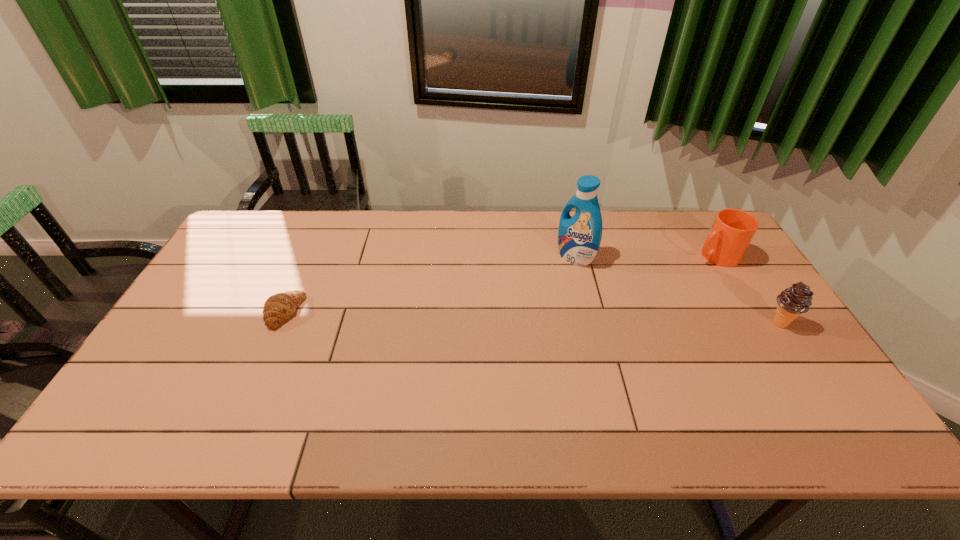
Identify the location of vacant spot on the desktop that is between the shortest object and the icecream and is positioned on the front-facing side of the tallest object. (492, 317).

Locate an element on the screen. The image size is (960, 540). free space on the desktop that is between the leftmost object and the icecream and is positioned on the handle side of the mug is located at coordinates (586, 319).